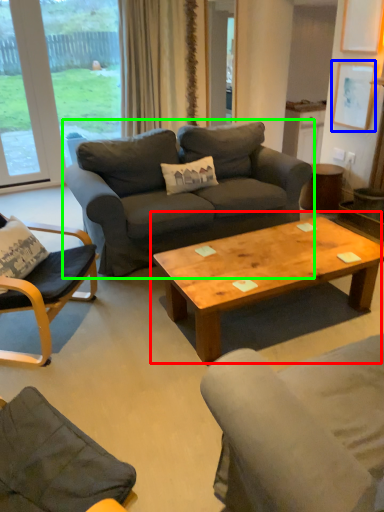
Question: Which is farther away from coffee table (highlighted by a red box)? picture frame (highlighted by a blue box) or studio couch (highlighted by a green box)?

Choices:
 (A) picture frame
 (B) studio couch

Answer: (A)